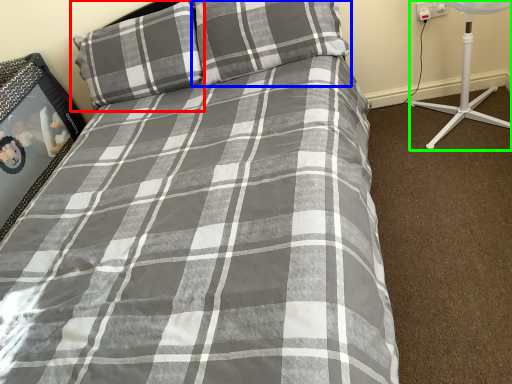
Question: Based on their relative distances, which object is nearer to pillow (highlighted by a red box)? Choose from pillow (highlighted by a blue box) and fan (highlighted by a green box).

Choices:
 (A) pillow
 (B) fan

Answer: (A)